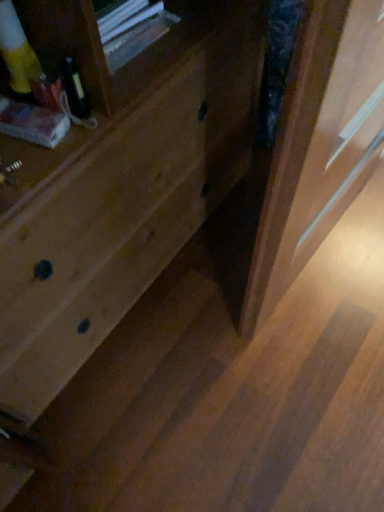
The height and width of the screenshot is (512, 384). I want to click on natural wood drawer at center, so click(99, 241).

What do you see at coordinates (99, 241) in the screenshot? This screenshot has height=512, width=384. I see `natural wood drawer at center` at bounding box center [99, 241].

The width and height of the screenshot is (384, 512). What do you see at coordinates (319, 145) in the screenshot? I see `wooden screen door at right` at bounding box center [319, 145].

What are the coordinates of `wooden screen door at right` in the screenshot? It's located at (319, 145).

Locate an element on the screen. natural wood drawer at center is located at coordinates (99, 241).

Considering the positions of objects wooden screen door at right and natural wood drawer at center in the image provided, who is more to the right, wooden screen door at right or natural wood drawer at center?

From the viewer's perspective, wooden screen door at right appears more on the right side.

Which is in front, wooden screen door at right or natural wood drawer at center?

natural wood drawer at center is in front.

Considering the points (335, 204) and (0, 309), which point is behind, point (335, 204) or point (0, 309)?

The point (335, 204) is farther from the camera.

From the image's perspective, which is above, wooden screen door at right or natural wood drawer at center?

natural wood drawer at center appears higher in the image.

From a real-world perspective, which object rests below the other?

wooden screen door at right.

Is wooden screen door at right thinner than natural wood drawer at center?

Yes, wooden screen door at right is thinner than natural wood drawer at center.

Can you confirm if wooden screen door at right is taller than natural wood drawer at center?

In fact, wooden screen door at right may be shorter than natural wood drawer at center.

Considering the relative sizes of wooden screen door at right and natural wood drawer at center in the image provided, is wooden screen door at right smaller than natural wood drawer at center?

Yes.

Is natural wood drawer at center surrounded by wooden screen door at right?

Actually, natural wood drawer at center is outside wooden screen door at right.

Is wooden screen door at right not near natural wood drawer at center?

wooden screen door at right is actually quite close to natural wood drawer at center.

Could you tell me if wooden screen door at right is facing natural wood drawer at center?

No, wooden screen door at right does not turn towards natural wood drawer at center.

Locate an element on the screen. drawer in front of the wooden screen door at right is located at coordinates (99, 241).

Considering the relative positions of natural wood drawer at center and wooden screen door at right in the image provided, is natural wood drawer at center to the right of wooden screen door at right from the viewer's perspective?

No.

Is natural wood drawer at center in front of or behind wooden screen door at right in the image?

natural wood drawer at center is in front of wooden screen door at right.

Is point (9, 381) positioned after point (292, 227)?

That is True.

From the image's perspective, relative to wooden screen door at right, is natural wood drawer at center above or below?

From the image's perspective, natural wood drawer at center appears above wooden screen door at right.

From a real-world perspective, is natural wood drawer at center on wooden screen door at right?

Correct, in the physical world, natural wood drawer at center is higher than wooden screen door at right.

From the picture: Which object is wider, natural wood drawer at center or wooden screen door at right?

natural wood drawer at center is wider.

Who is shorter, natural wood drawer at center or wooden screen door at right?

Standing shorter between the two is wooden screen door at right.

Looking at this image, based on their sizes in the image, would you say natural wood drawer at center is bigger or smaller than wooden screen door at right?

natural wood drawer at center is bigger than wooden screen door at right.

Is natural wood drawer at center inside or outside of wooden screen door at right?

natural wood drawer at center is not inside wooden screen door at right, it's outside.

Is there a large distance between natural wood drawer at center and wooden screen door at right?

No, natural wood drawer at center is not far away from wooden screen door at right.

Is natural wood drawer at center facing away from wooden screen door at right?

No.

Locate an element on the screen. This screenshot has height=512, width=384. screen door directly beneath the natural wood drawer at center (from a real-world perspective) is located at coordinates (319, 145).

You are a GUI agent. You are given a task and a screenshot of the screen. Output one action in this format:
    pyautogui.click(x=<x>, y=<y>)
    Task: Click on the drawer above the wooden screen door at right (from a real-world perspective)
    The width and height of the screenshot is (384, 512).
    Given the screenshot: What is the action you would take?
    pyautogui.click(x=99, y=241)

Identify the location of screen door located on the right of natural wood drawer at center. The width and height of the screenshot is (384, 512). (319, 145).